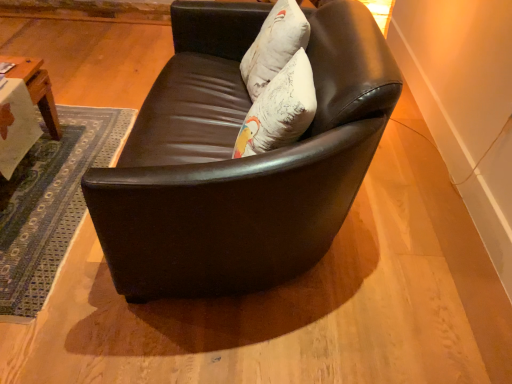
Identify the location of unoccupied region to the right of matte black couch at center. Image resolution: width=512 pixels, height=384 pixels. (415, 223).